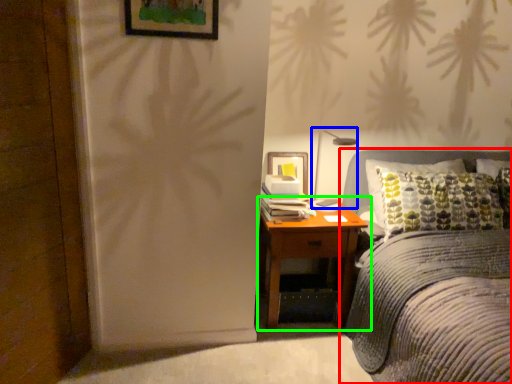
Question: Which is farther away from bed (highlighted by a red box)? bedside lamp (highlighted by a blue box) or nightstand (highlighted by a green box)?

Choices:
 (A) bedside lamp
 (B) nightstand

Answer: (A)